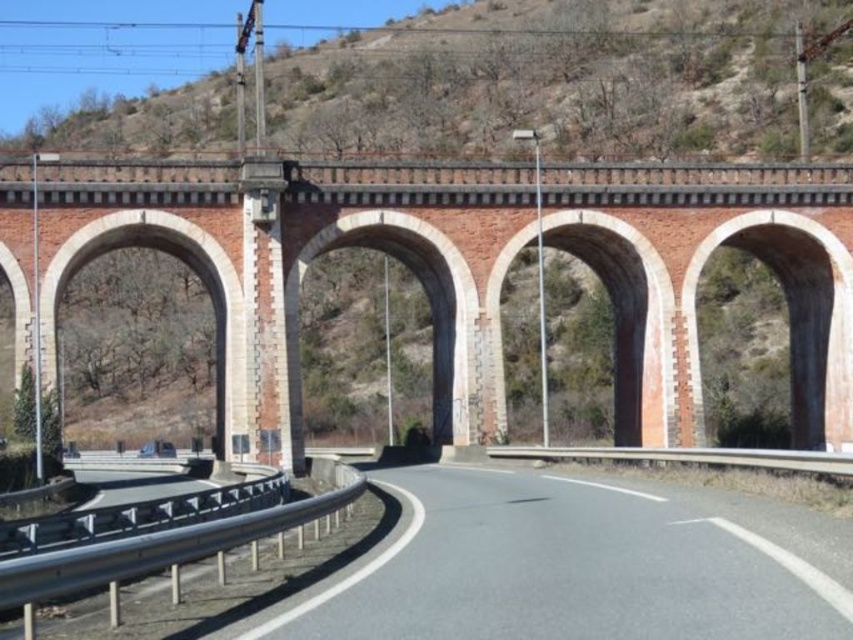
Question: Estimate the real-world distances between objects in this image. Which object is closer to the red brick bridge at center?

Choices:
 (A) metallic gray train track at lower left
 (B) gray asphalt road at center

Answer: (A)

Question: Observing the image, what is the correct spatial positioning of red brick bridge at center in reference to metallic gray train track at lower left?

Choices:
 (A) above
 (B) below

Answer: (A)

Question: Can you confirm if red brick bridge at center is thinner than metallic gray train track at lower left?

Choices:
 (A) no
 (B) yes

Answer: (A)

Question: Which of the following is the farthest from the observer?

Choices:
 (A) gray asphalt road at center
 (B) metallic gray train track at lower left

Answer: (A)

Question: Estimate the real-world distances between objects in this image. Which object is farther from the gray asphalt road at center?

Choices:
 (A) red brick bridge at center
 (B) metallic gray train track at lower left

Answer: (A)

Question: Does red brick bridge at center have a lesser width compared to gray asphalt road at center?

Choices:
 (A) yes
 (B) no

Answer: (B)